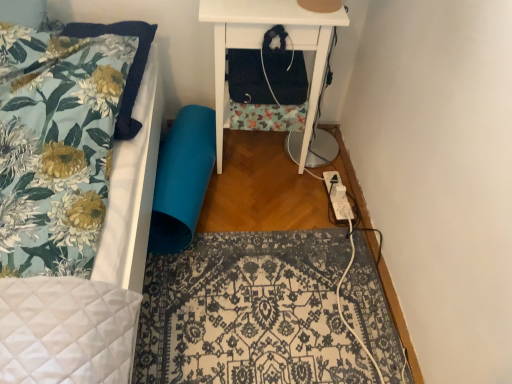
Question: Would you say floral fabric pillow at upper left is part of white plastic extension cord at lower right's contents?

Choices:
 (A) no
 (B) yes

Answer: (A)

Question: Considering the relative sizes of white plastic extension cord at lower right and floral fabric pillow at upper left in the image provided, is white plastic extension cord at lower right shorter than floral fabric pillow at upper left?

Choices:
 (A) yes
 (B) no

Answer: (A)

Question: Considering the relative positions of white plastic extension cord at lower right and floral fabric pillow at upper left in the image provided, is white plastic extension cord at lower right to the left of floral fabric pillow at upper left from the viewer's perspective?

Choices:
 (A) yes
 (B) no

Answer: (B)

Question: Can you confirm if white plastic extension cord at lower right is smaller than floral fabric pillow at upper left?

Choices:
 (A) yes
 (B) no

Answer: (A)

Question: Is white plastic extension cord at lower right aimed at floral fabric pillow at upper left?

Choices:
 (A) yes
 (B) no

Answer: (B)

Question: From the image's perspective, is white plastic extension cord at lower right located above floral fabric pillow at upper left?

Choices:
 (A) no
 (B) yes

Answer: (A)

Question: Does patterned fabric rug at center contain white matte nightstand at upper right?

Choices:
 (A) no
 (B) yes

Answer: (A)

Question: Considering the relative positions of patterned fabric rug at center and white matte nightstand at upper right in the image provided, is patterned fabric rug at center to the right of white matte nightstand at upper right from the viewer's perspective?

Choices:
 (A) no
 (B) yes

Answer: (B)

Question: From the image's perspective, is patterned fabric rug at center on top of white matte nightstand at upper right?

Choices:
 (A) yes
 (B) no

Answer: (B)

Question: Can you confirm if patterned fabric rug at center is smaller than white matte nightstand at upper right?

Choices:
 (A) yes
 (B) no

Answer: (A)

Question: From a real-world perspective, is patterned fabric rug at center on top of white matte nightstand at upper right?

Choices:
 (A) yes
 (B) no

Answer: (B)

Question: From the image's perspective, is patterned fabric rug at center under white matte nightstand at upper right?

Choices:
 (A) yes
 (B) no

Answer: (A)

Question: Is the surface of floral fabric pillow at upper left in direct contact with patterned fabric rug at center?

Choices:
 (A) yes
 (B) no

Answer: (B)